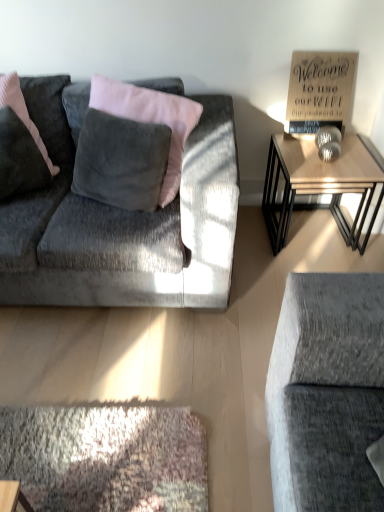
Question: Does wooden sign at upper right come behind velvet dark gray pillow at left?

Choices:
 (A) yes
 (B) no

Answer: (A)

Question: Is wooden sign at upper right facing away from velvet dark gray pillow at left?

Choices:
 (A) no
 (B) yes

Answer: (A)

Question: Can you confirm if wooden sign at upper right is positioned to the left of velvet dark gray pillow at left?

Choices:
 (A) yes
 (B) no

Answer: (B)

Question: Does wooden sign at upper right have a lesser width compared to velvet dark gray pillow at left?

Choices:
 (A) no
 (B) yes

Answer: (B)

Question: Considering the relative sizes of wooden sign at upper right and velvet dark gray pillow at left in the image provided, is wooden sign at upper right smaller than velvet dark gray pillow at left?

Choices:
 (A) no
 (B) yes

Answer: (B)

Question: From a real-world perspective, is velvet dark gray pillow at left physically located above or below wooden table at right?

Choices:
 (A) above
 (B) below

Answer: (A)

Question: Visually, is velvet dark gray pillow at left positioned to the left or to the right of wooden table at right?

Choices:
 (A) left
 (B) right

Answer: (A)

Question: Is velvet dark gray pillow at left in front of or behind wooden table at right in the image?

Choices:
 (A) front
 (B) behind

Answer: (A)

Question: Is velvet dark gray pillow at left wider or thinner than wooden table at right?

Choices:
 (A) wide
 (B) thin

Answer: (B)

Question: Is wooden sign at upper right in front of or behind velvet dark gray pillow at left in the image?

Choices:
 (A) behind
 (B) front

Answer: (A)

Question: Is point (306, 68) closer or farther from the camera than point (52, 169)?

Choices:
 (A) farther
 (B) closer

Answer: (A)

Question: Would you say wooden sign at upper right is inside or outside velvet dark gray pillow at left?

Choices:
 (A) inside
 (B) outside

Answer: (B)

Question: In terms of height, does wooden sign at upper right look taller or shorter compared to velvet dark gray pillow at left?

Choices:
 (A) short
 (B) tall

Answer: (A)

Question: Relative to wooden table at right, is wooden sign at upper right in front or behind?

Choices:
 (A) behind
 (B) front

Answer: (A)

Question: Considering the relative positions of wooden sign at upper right and wooden table at right in the image provided, is wooden sign at upper right to the left or to the right of wooden table at right?

Choices:
 (A) left
 (B) right

Answer: (A)